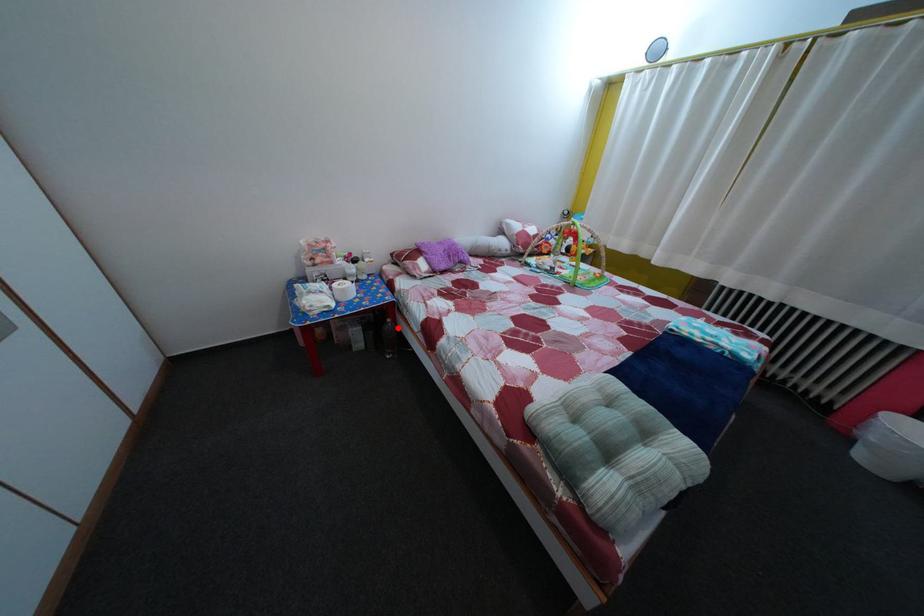
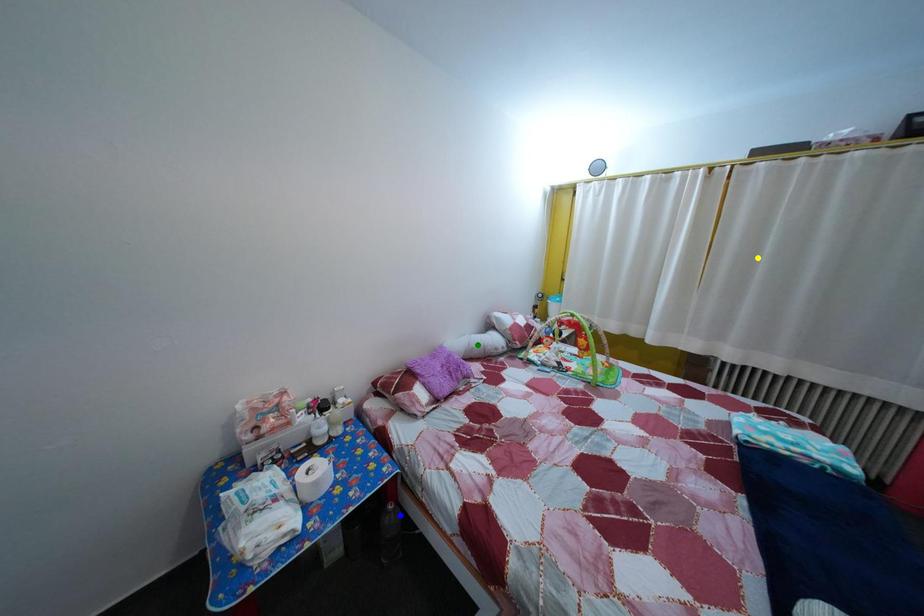
Question: I am providing you with two images of the same scene from different viewpoints. A red point is marked on the first image. You are given multiple points on the second image. In image 2, which mark is for the same physical point as the one in image 1?

Choices:
 (A) blue point
 (B) green point
 (C) yellow point

Answer: (A)